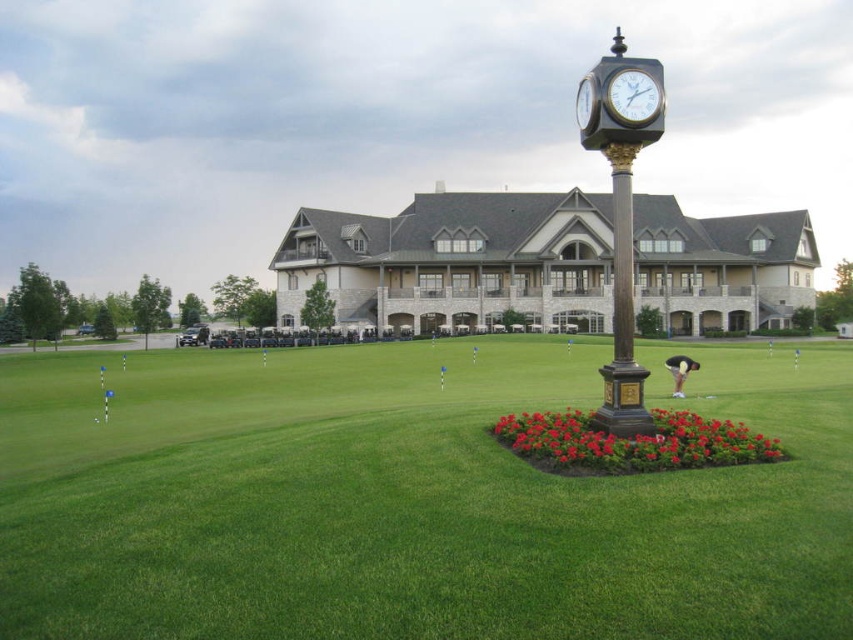
Question: Which of the following is the farthest from the observer?

Choices:
 (A) vivid red petals at center
 (B) polished bronze clock at center
 (C) bronze/golden pole at center
 (D) gold metallic clock at center

Answer: (B)

Question: Is bronze/golden pole at center behind gold metallic clock at center?

Choices:
 (A) yes
 (B) no

Answer: (A)

Question: Estimate the real-world distances between objects in this image. Which object is closer to the polished bronze clock at center?

Choices:
 (A) bronze/golden pole at center
 (B) metallic gold clock at center

Answer: (A)

Question: Is green grass at center to the right of metallic gold clock at center from the viewer's perspective?

Choices:
 (A) yes
 (B) no

Answer: (B)

Question: Does vivid red petals at center lie in front of gold metallic clock at center?

Choices:
 (A) yes
 (B) no

Answer: (A)

Question: Which point is farther to the camera?

Choices:
 (A) bronze/golden pole at center
 (B) green grass at center
 (C) metallic gold clock at center

Answer: (C)